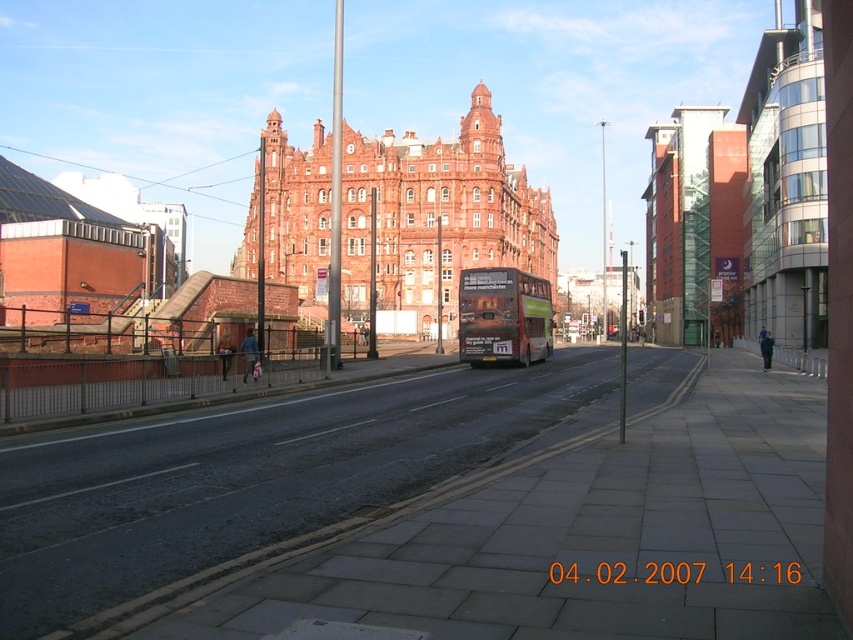
You are standing on the sidewalk and looking at the urban street scene. There are two points marked in the image, point (473, 154) and point (517, 323). Which point is closer to you?

Point (473, 154) is further to the camera than point (517, 323), so the point closer to you is point (517, 323).